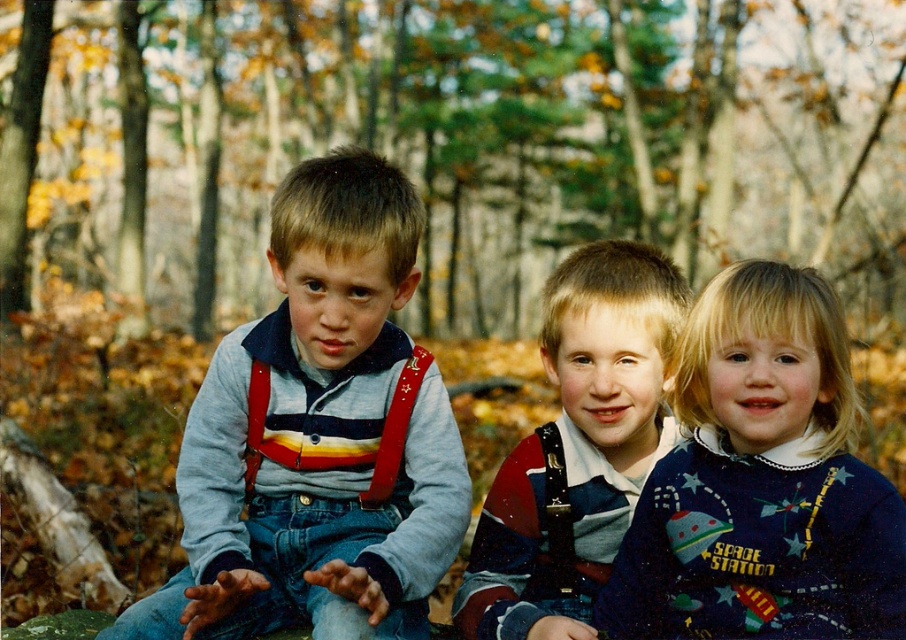
Consider the image. Which is more to the left, space-themed sweater at center or matte striped shirt at center?

matte striped shirt at center

Which is in front, point (758, 412) or point (537, 573)?

Point (758, 412) is more forward.

You are a GUI agent. You are given a task and a screenshot of the screen. Output one action in this format:
    pyautogui.click(x=<x>, y=<y>)
    Task: Click on the space-themed sweater at center
    Image resolution: width=906 pixels, height=640 pixels.
    Given the screenshot: What is the action you would take?
    pyautogui.click(x=760, y=483)

Does point (223, 458) come in front of point (757, 314)?

No, it is not.

The width and height of the screenshot is (906, 640). I want to click on matte gray sweater at center, so click(x=317, y=435).

Where is `matte gray sweater at center`? The width and height of the screenshot is (906, 640). matte gray sweater at center is located at coordinates (317, 435).

Can you confirm if matte gray sweater at center is shorter than matte striped shirt at center?

No.

Is matte gray sweater at center wider than matte striped shirt at center?

Correct, the width of matte gray sweater at center exceeds that of matte striped shirt at center.

Identify the location of matte gray sweater at center. (317, 435).

In order to click on matte gray sweater at center in this screenshot , I will do `click(317, 435)`.